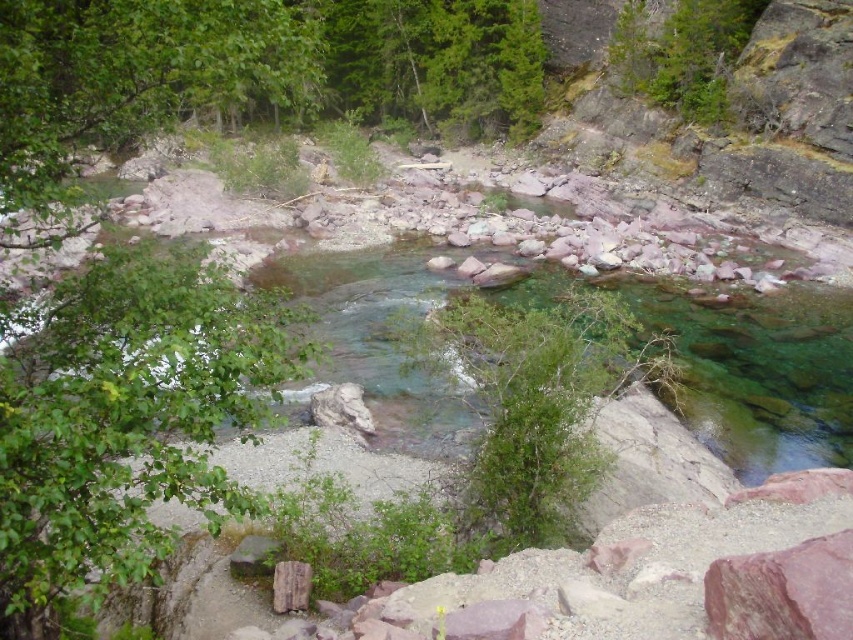
Measure the distance between green leafy bush at center and brown rough stone at center.

A distance of 12.95 feet exists between green leafy bush at center and brown rough stone at center.

Who is positioned more to the left, green leafy bush at center or brown rough stone at center?

Positioned to the left is brown rough stone at center.

The image size is (853, 640). What do you see at coordinates (540, 403) in the screenshot?
I see `green leafy bush at center` at bounding box center [540, 403].

The height and width of the screenshot is (640, 853). I want to click on green leafy bush at center, so click(540, 403).